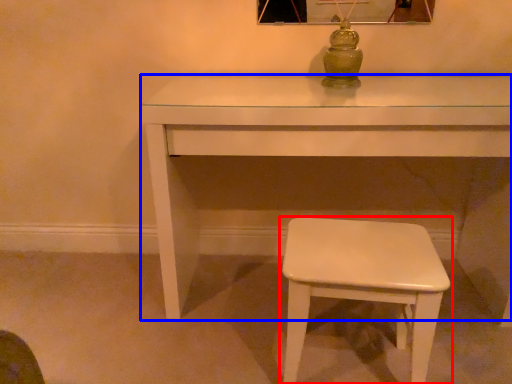
Question: Which object appears closest to the camera in this image, stool (highlighted by a red box) or table (highlighted by a blue box)?

Choices:
 (A) stool
 (B) table

Answer: (A)